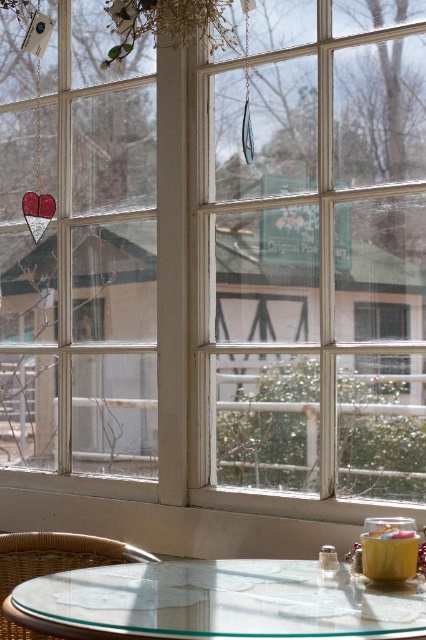
Consider the image. You are planning to place a large potted plant on the transparent glass table at lower center. Considering the size of the table compared to the rattan chair at lower left, will the plant fit comfortably without overcrowding the space?

The transparent glass table at lower center is bigger than the rattan chair at lower left, so the plant should fit comfortably as the table has more space compared to the chair.

You are a delivery person trying to place a package that is 12 inches long on the floor between the transparent glass table at lower center and the rattan chair at lower left. Can the package fit in that space?

The distance between the transparent glass table at lower center and the rattan chair at lower left is 10.94 inches. Since the package is 12 inches long, it cannot fit in the space between them.

Looking at this image, you are standing in the room shown in the image and want to place a small red item on the transparent glass table at lower center. Based on the coordinates provided, can you confirm if the point marked at (221, 600) is the correct location for placing the item?

Yes, the point marked at (221, 600) corresponds to the transparent glass table at lower center, so placing the small red item there would be accurate.